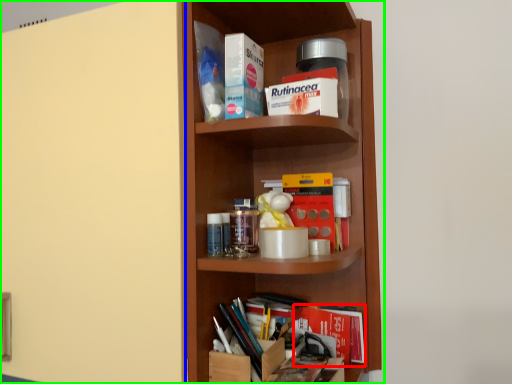
Question: Which object is positioned closest to book (highlighted by a red box)? Select from door (highlighted by a blue box) and shelf (highlighted by a green box).

Choices:
 (A) door
 (B) shelf

Answer: (B)